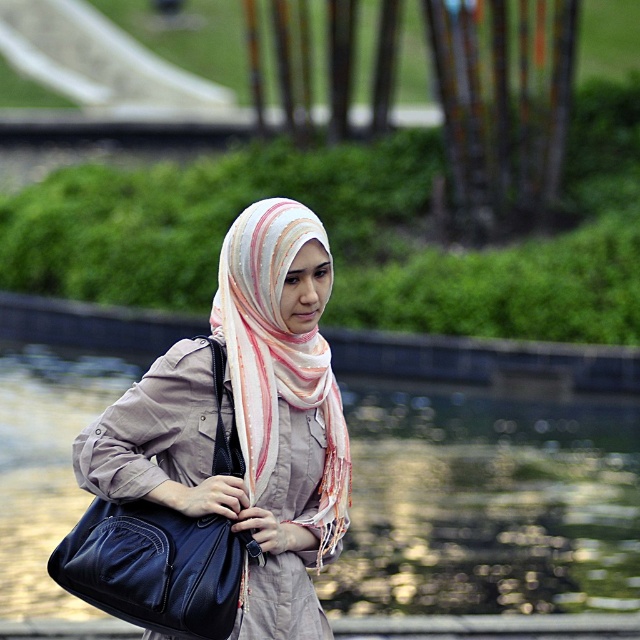
Question: Which object is the closest to the matte blue leather bag at center?

Choices:
 (A) glossy water at center
 (B) matte beige scarf at center

Answer: (B)

Question: Which object is positioned closest to the glossy water at center?

Choices:
 (A) matte beige scarf at center
 (B) matte blue leather bag at center
 (C) striped silk scarf at center

Answer: (A)

Question: Can you confirm if matte beige scarf at center is positioned below striped silk scarf at center?

Choices:
 (A) no
 (B) yes

Answer: (B)

Question: Is matte beige scarf at center wider than striped silk scarf at center?

Choices:
 (A) no
 (B) yes

Answer: (B)

Question: Does glossy water at center appear under matte blue leather bag at center?

Choices:
 (A) no
 (B) yes

Answer: (A)

Question: Which object is the farthest from the striped silk scarf at center?

Choices:
 (A) matte blue leather bag at center
 (B) matte beige scarf at center
 (C) glossy water at center

Answer: (C)